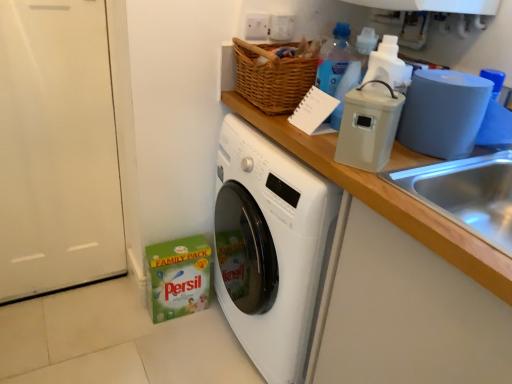
Question: Can you confirm if translucent plastic bottle at upper right, the 1th bottle positioned from the bottom, is positioned to the left of beige plastic container at upper right?

Choices:
 (A) yes
 (B) no

Answer: (A)

Question: From a real-world perspective, is translucent plastic bottle at upper right, positioned as the second bottle in top-to-bottom order, physically below beige plastic container at upper right?

Choices:
 (A) yes
 (B) no

Answer: (B)

Question: Is translucent plastic bottle at upper right, the 2th bottle in the back-to-front sequence, to the right of beige plastic container at upper right from the viewer's perspective?

Choices:
 (A) no
 (B) yes

Answer: (A)

Question: Does translucent plastic bottle at upper right, positioned as the first bottle in front-to-back order, have a lesser height compared to beige plastic container at upper right?

Choices:
 (A) no
 (B) yes

Answer: (A)

Question: Is the position of translucent plastic bottle at upper right, positioned as the second bottle in top-to-bottom order, less distant than that of beige plastic container at upper right?

Choices:
 (A) yes
 (B) no

Answer: (B)

Question: Does translucent plastic bottle at upper right, the 1th bottle positioned from the bottom, have a larger size compared to beige plastic container at upper right?

Choices:
 (A) no
 (B) yes

Answer: (A)

Question: Does blue matte toilet paper at right have a smaller size compared to beige plastic container at upper right?

Choices:
 (A) yes
 (B) no

Answer: (B)

Question: Can you confirm if blue matte toilet paper at right is positioned to the right of beige plastic container at upper right?

Choices:
 (A) yes
 (B) no

Answer: (A)

Question: Can you confirm if blue matte toilet paper at right is shorter than beige plastic container at upper right?

Choices:
 (A) no
 (B) yes

Answer: (B)

Question: Can you confirm if blue matte toilet paper at right is thinner than beige plastic container at upper right?

Choices:
 (A) yes
 (B) no

Answer: (B)

Question: From a real-world perspective, is blue matte toilet paper at right located higher than beige plastic container at upper right?

Choices:
 (A) no
 (B) yes

Answer: (A)

Question: From the image's perspective, is blue matte toilet paper at right over beige plastic container at upper right?

Choices:
 (A) yes
 (B) no

Answer: (A)

Question: Can you confirm if wooden at upper right is positioned to the right of blue translucent bottle at upper center, which appears as the second bottle when ordered from the bottom?

Choices:
 (A) yes
 (B) no

Answer: (B)